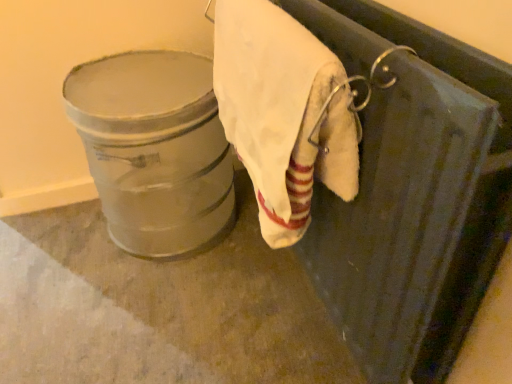
Question: Considering the relative positions of metallic silver bucket at left and white cotton towel at upper right in the image provided, is metallic silver bucket at left to the left or to the right of white cotton towel at upper right?

Choices:
 (A) left
 (B) right

Answer: (A)

Question: From the image's perspective, is metallic silver bucket at left above or below white cotton towel at upper right?

Choices:
 (A) above
 (B) below

Answer: (B)

Question: Is metallic silver bucket at left in front of or behind white cotton towel at upper right in the image?

Choices:
 (A) behind
 (B) front

Answer: (A)

Question: Is white cotton towel at upper right wider or thinner than metallic silver bucket at left?

Choices:
 (A) wide
 (B) thin

Answer: (B)

Question: Based on their sizes in the image, would you say white cotton towel at upper right is bigger or smaller than metallic silver bucket at left?

Choices:
 (A) big
 (B) small

Answer: (B)

Question: Is white cotton towel at upper right spatially inside metallic silver bucket at left, or outside of it?

Choices:
 (A) inside
 (B) outside

Answer: (B)

Question: From a real-world perspective, is white cotton towel at upper right positioned above or below metallic silver bucket at left?

Choices:
 (A) above
 (B) below

Answer: (A)